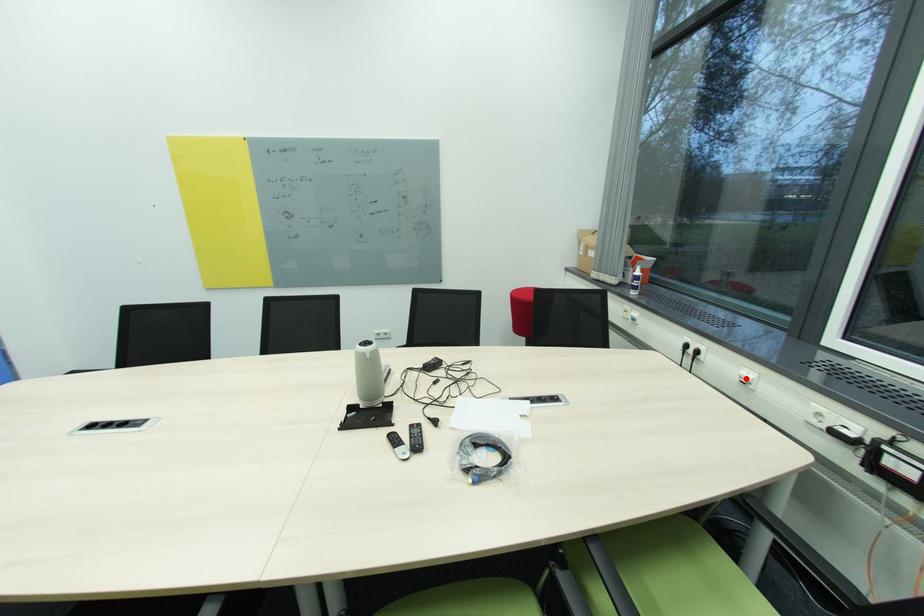
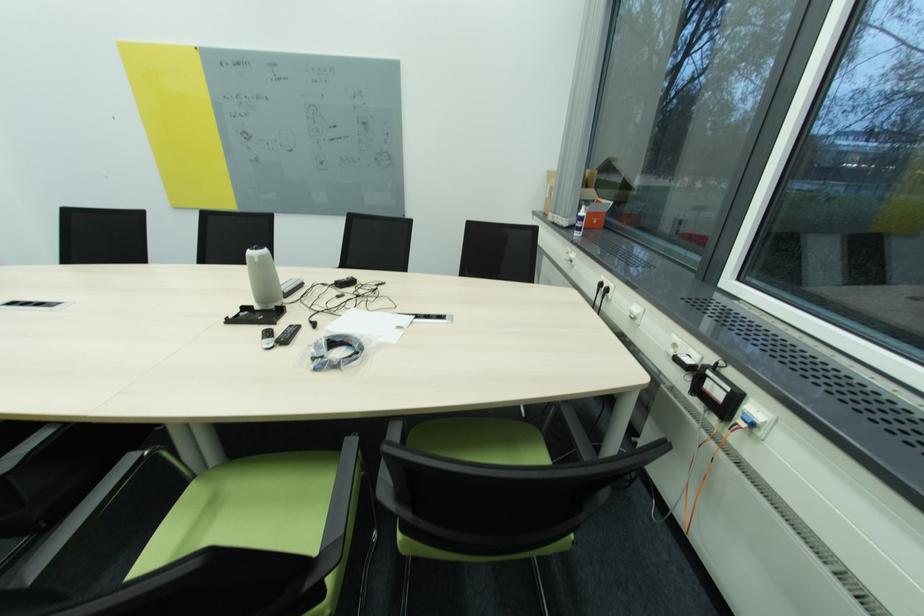
Question: I am providing you with two images of the same scene from different viewpoints. Image1 has a red point marked. In image2, the corresponding 3D location appears at what relative position? Reply with the corresponding letter.

Choices:
 (A) Closer
 (B) Farther

Answer: (A)